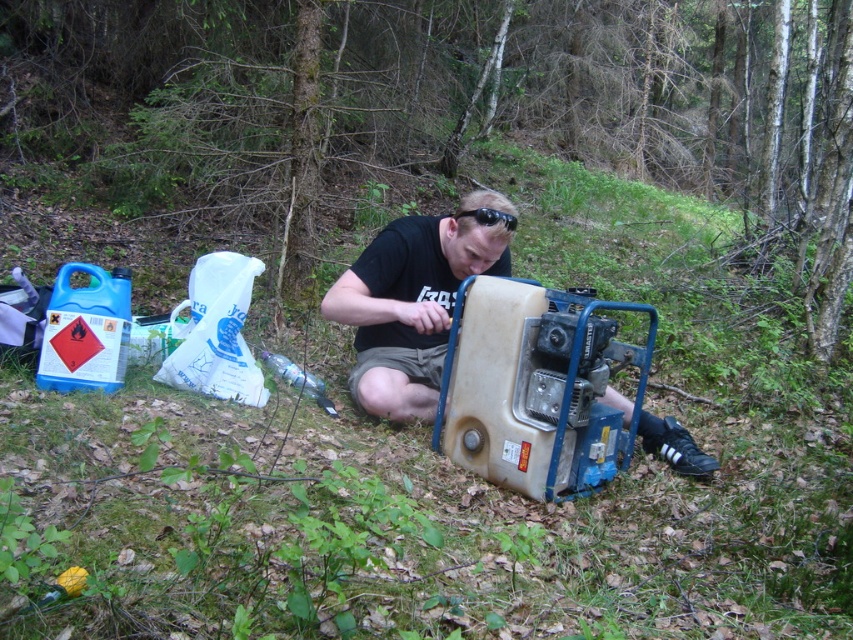
You are a technician trying to locate the correct generator to repair. You see a beige plastic generator at center and a matte black generator at center. According to the scene, which generator is positioned to the right side of the other?

The beige plastic generator at center is positioned on the right side of matte black generator at center.

You are a technician trying to fix a generator in a wooded area. You notice two generators, the beige plastic generator at center and the matte black generator at center. Which one is positioned lower in the image?

The beige plastic generator at center is positioned lower than the matte black generator at center according to the description.

You are a technician in the woods and need to inspect both the beige plastic generator at center and the matte black generator at center. Which one should you check first based on their positions?

You should check the beige plastic generator at center first because it is closer to you than the matte black generator at center.